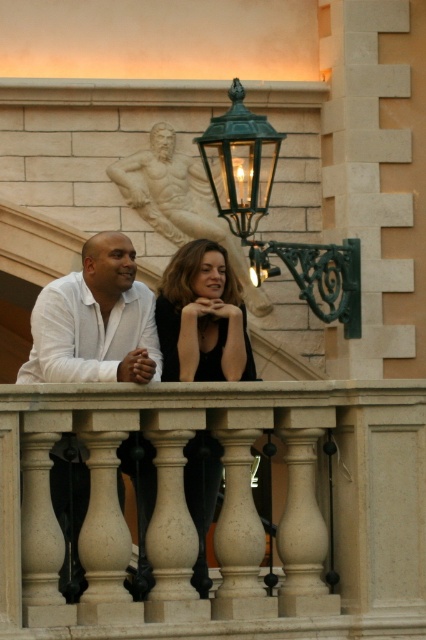
Question: Does green metal lantern at upper center have a lesser width compared to black matte dress at center?

Choices:
 (A) yes
 (B) no

Answer: (B)

Question: Which is nearer to the white marble balustrade at center?

Choices:
 (A) bronze statue at upper center
 (B) green metal lantern at upper center

Answer: (B)

Question: Is green metal lantern at upper center wider than black matte dress at center?

Choices:
 (A) no
 (B) yes

Answer: (B)

Question: Does white marble balustrade at center appear on the left side of bronze statue at upper center?

Choices:
 (A) no
 (B) yes

Answer: (A)

Question: Which point appears farthest from the camera in this image?

Choices:
 (A) (284, 630)
 (B) (245, 209)
 (C) (203, 342)

Answer: (B)

Question: Which point is closer to the camera?

Choices:
 (A) (325, 294)
 (B) (54, 500)
 (C) (227, 353)

Answer: (C)